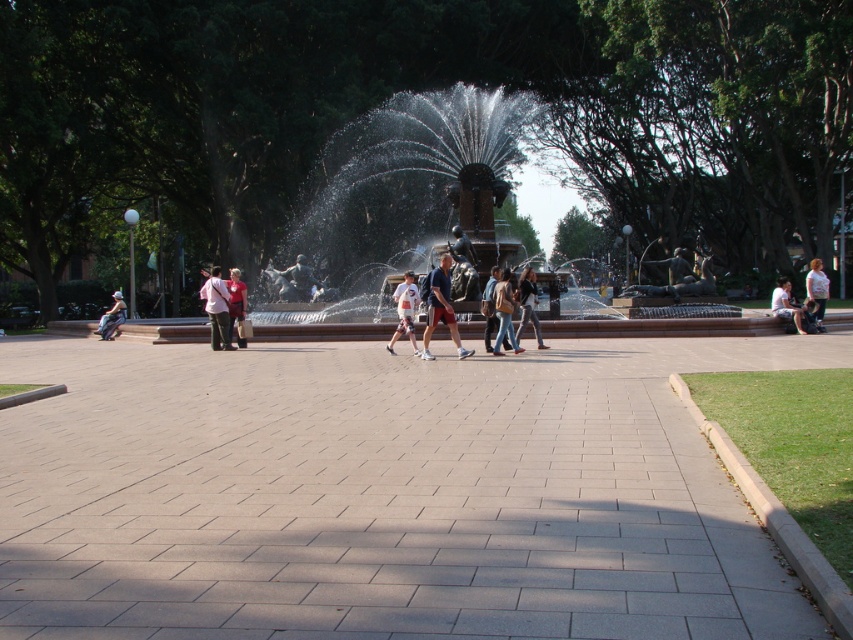
Does matte black jacket at center have a greater width compared to light blue denim jeans at lower right?

Incorrect, matte black jacket at center's width does not surpass light blue denim jeans at lower right's.

Is point (527, 284) more distant than point (782, 289)?

That is False.

Which is behind, point (531, 316) or point (790, 296)?

The point (790, 296) is more distant.

Locate an element on the screen. This screenshot has width=853, height=640. matte black jacket at center is located at coordinates (527, 305).

Is light brown leather jacket at right thinner than light blue denim jeans at left?

Yes.

Who is more distant from viewer, (822, 326) or (102, 333)?

Positioned behind is point (102, 333).

Does point (811, 269) come farther from viewer compared to point (122, 304)?

That is False.

Find the location of `light brown leather jacket at right`. light brown leather jacket at right is located at coordinates (817, 291).

In the scene shown: Does light brown leather jacket at right appear under light blue denim jeans at lower right?

No, light brown leather jacket at right is not below light blue denim jeans at lower right.

Which is more to the right, light brown leather jacket at right or light blue denim jeans at lower right?

light brown leather jacket at right is more to the right.

Which is behind, point (809, 273) or point (786, 298)?

The point (809, 273) is behind.

Identify the location of light brown leather jacket at right. (817, 291).